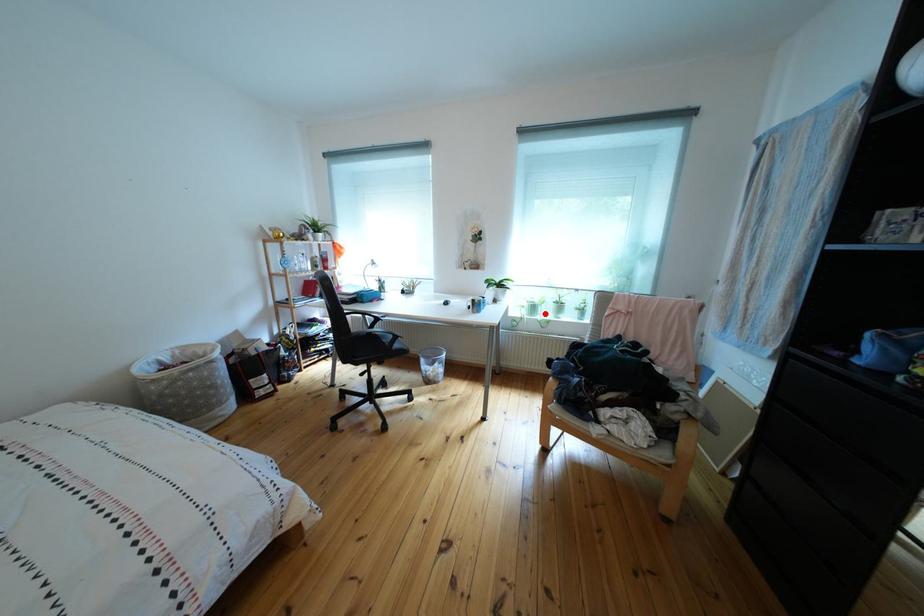
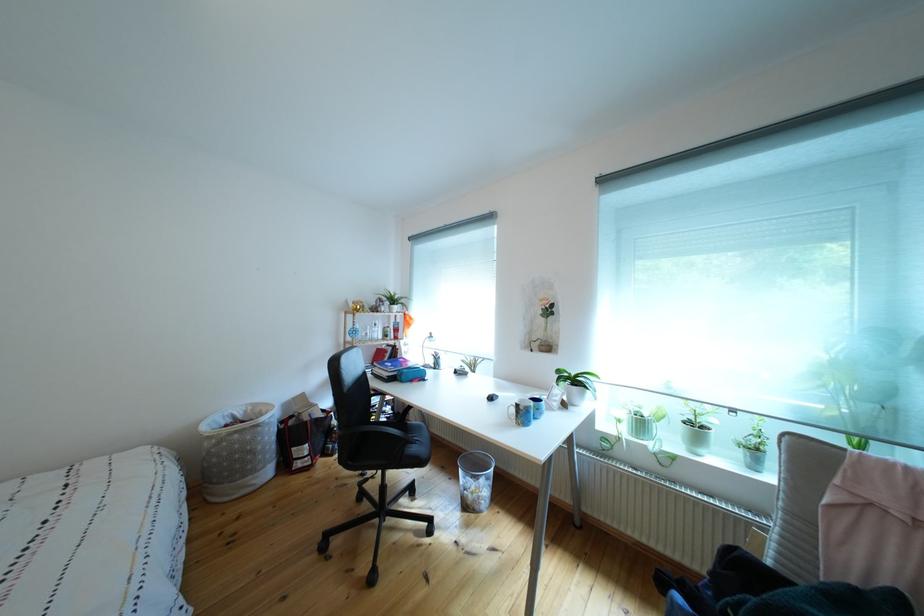
Locate, in the second image, the point that corresponds to the highlighted location in the first image.

(652, 430)